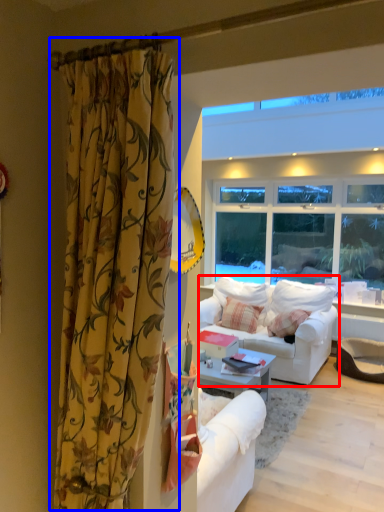
Question: Which object appears farthest to the camera in this image, studio couch (highlighted by a red box) or curtain (highlighted by a blue box)?

Choices:
 (A) studio couch
 (B) curtain

Answer: (A)